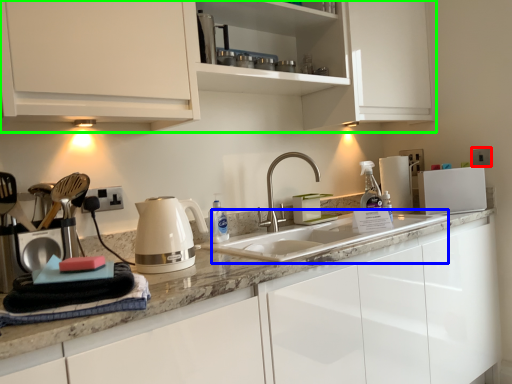
Question: Which object is the closest to the electric outlet (highlighted by a red box)? Choose among these: sink (highlighted by a blue box) or cabinetry (highlighted by a green box).

Choices:
 (A) sink
 (B) cabinetry

Answer: (A)